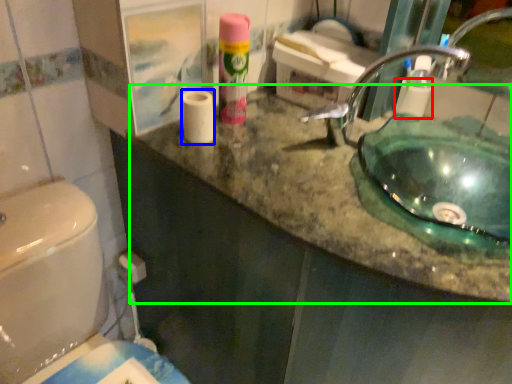
Question: Estimate the real-world distances between objects in this image. Which object is farther from toilet paper (highlighted by a red box), toilet paper (highlighted by a blue box) or counter top (highlighted by a green box)?

Choices:
 (A) toilet paper
 (B) counter top

Answer: (A)